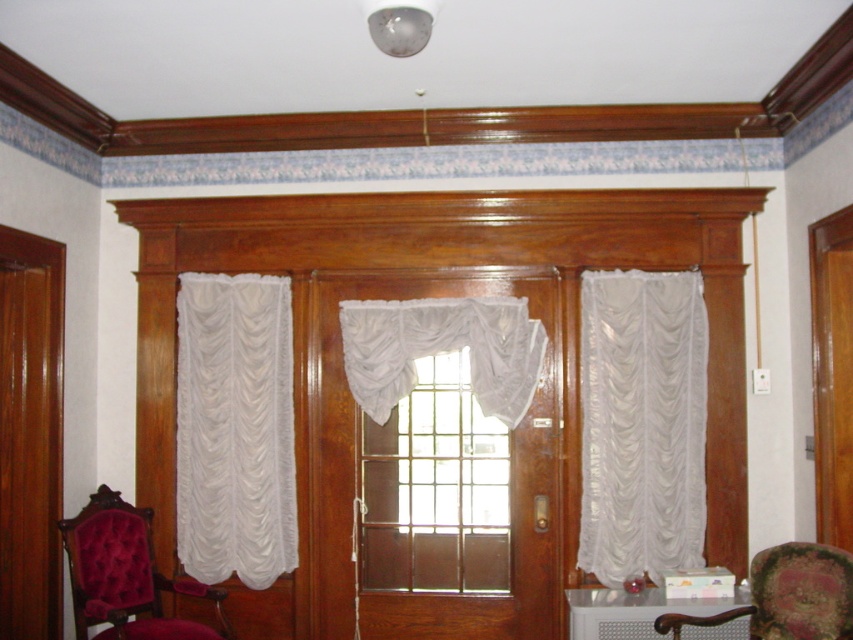
You are standing in the room and want to adjust the curtains. Which curtain, the white sheer curtain at right or the white sheer curtain at left, is positioned higher up relative to the other?

The white sheer curtain at right is located above the white sheer curtain at left, so it is positioned higher up.

You are a decorator planning to place a 1.5 meter wide decorative shelf between the white sheer curtain at right and the white sheer curtain at left. Based on the scene, will the shelf fit without overlapping the curtains?

The distance between the white sheer curtain at right and white sheer curtain at left is 1.41 meters, which is less than the shelf width of 1.5 meters. Therefore, the shelf will not fit without overlapping the curtains.

You are standing in the room and want to determine which of the two white sheer curtains is larger. The curtains in question are the white sheer curtain at right and the white sheer curtain at center. Based on their sizes, which one is bigger?

The white sheer curtain at right is bigger than the white sheer curtain at center according to the description.